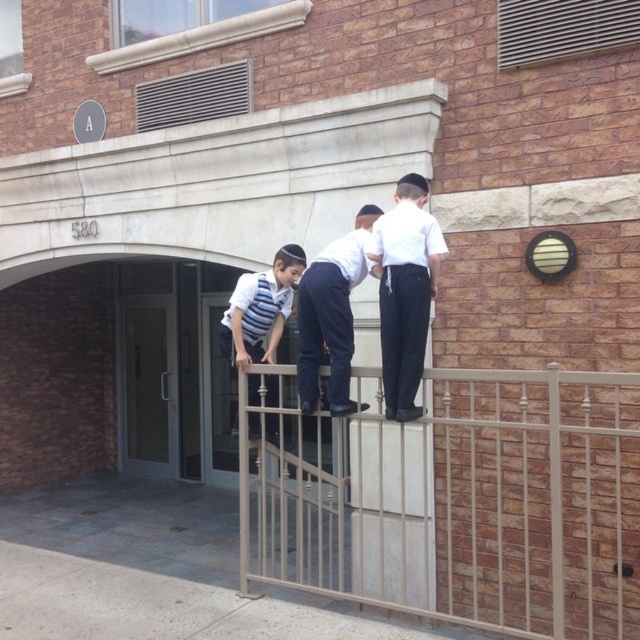
Is tan wrought iron fence at upper center positioned at the back of striped fabric shirt at upper center?

No, it is in front of striped fabric shirt at upper center.

This screenshot has height=640, width=640. I want to click on tan wrought iron fence at upper center, so tap(460, 502).

Between point (518, 618) and point (147, 420), which one is positioned behind?

Positioned behind is point (147, 420).

Between tan wrought iron fence at upper center and translucent glass door at center, which one appears on the left side from the viewer's perspective?

translucent glass door at center is more to the left.

Which is behind, point (528, 417) or point (154, 305)?

The point (154, 305) is more distant.

This screenshot has width=640, height=640. In order to click on tan wrought iron fence at upper center in this screenshot , I will do `click(460, 502)`.

Can you confirm if translucent glass door at center is bigger than white matte uniform at center?

Yes.

Is point (145, 298) positioned before point (307, 372)?

No.

Is point (173, 348) farther from camera compared to point (308, 310)?

Yes, it is behind point (308, 310).

Identify the location of translucent glass door at center. The height and width of the screenshot is (640, 640). (147, 385).